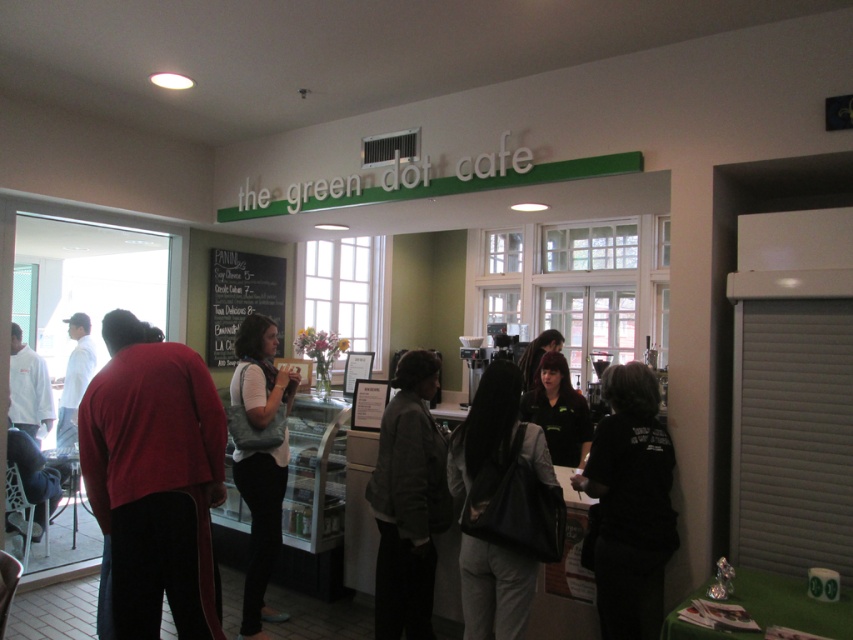
Is the position of dark red sweater at left less distant than that of black fabric shirt at center?

Yes.

Who is more forward, (142, 524) or (549, 376)?

Point (142, 524) is more forward.

Image resolution: width=853 pixels, height=640 pixels. In order to click on dark red sweater at left in this screenshot , I will do `click(154, 477)`.

Who is positioned more to the left, black matte shirt at center or white cotton shirt at left?

white cotton shirt at left

Which is in front, point (585, 488) or point (73, 349)?

Point (585, 488) is more forward.

I want to click on black matte shirt at center, so 630,504.

Is black matte shirt at center thinner than white matte chef coat at left?

No, black matte shirt at center is not thinner than white matte chef coat at left.

Does black matte shirt at center appear on the left side of white matte chef coat at left?

Incorrect, black matte shirt at center is not on the left side of white matte chef coat at left.

What do you see at coordinates (630, 504) in the screenshot?
I see `black matte shirt at center` at bounding box center [630, 504].

Identify the location of black matte shirt at center. (630, 504).